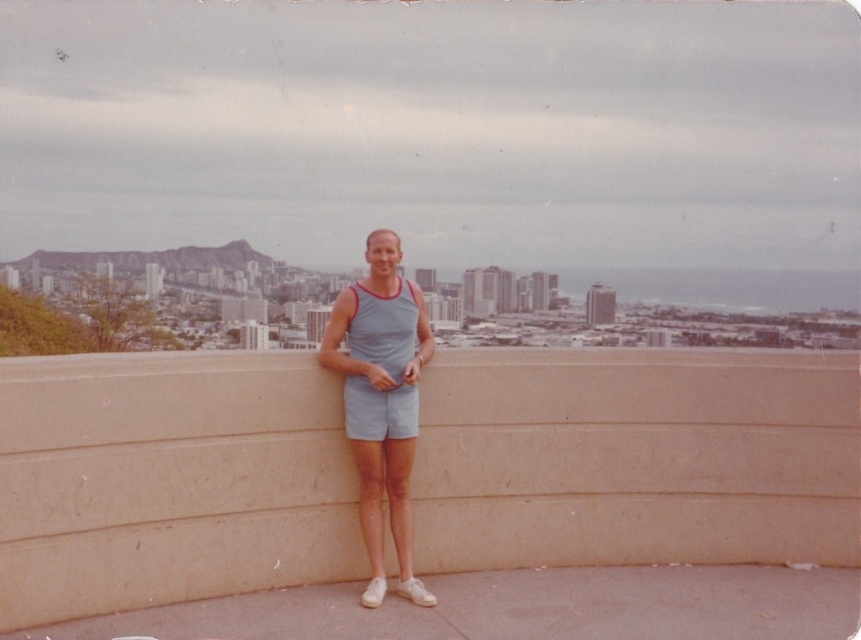
Locate an element on the screen. The height and width of the screenshot is (640, 861). beige concrete ledge at center is located at coordinates (636, 458).

Between point (150, 467) and point (320, 356), which one is positioned in front?

Point (150, 467) is in front.

Where is `beige concrete ledge at center`? Image resolution: width=861 pixels, height=640 pixels. beige concrete ledge at center is located at coordinates (636, 458).